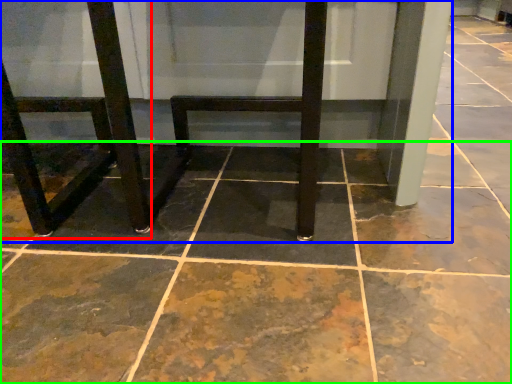
Question: Which is nearer to the chair (highlighted by a red box)? furniture (highlighted by a blue box) or concrete (highlighted by a green box).

Choices:
 (A) furniture
 (B) concrete

Answer: (A)